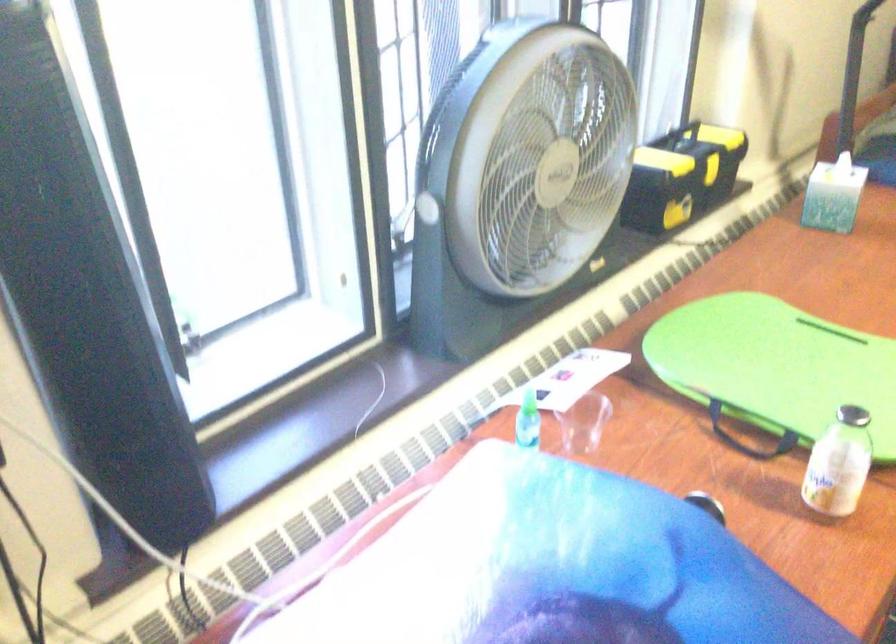
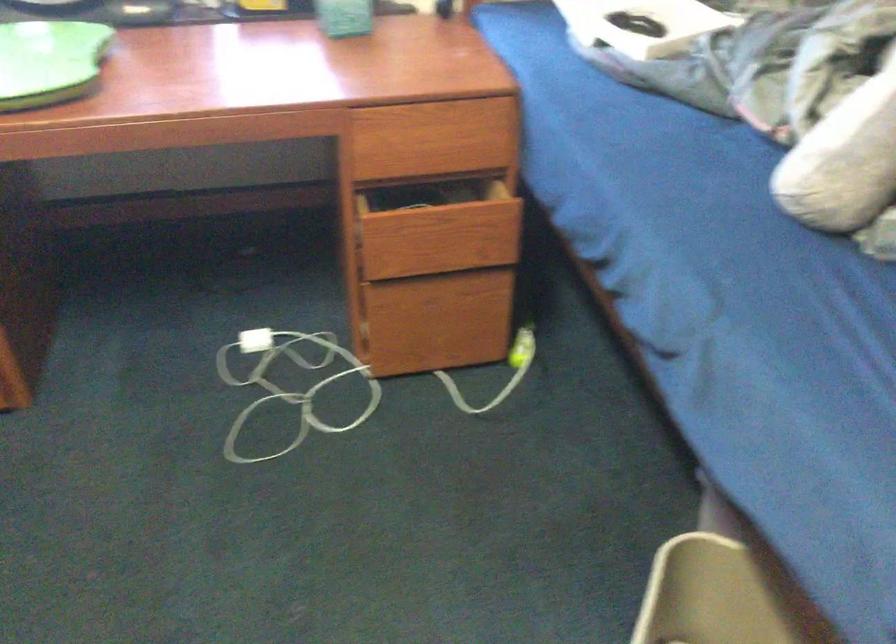
Find the pixel in the second image that matches (824,371) in the first image.

(49, 62)